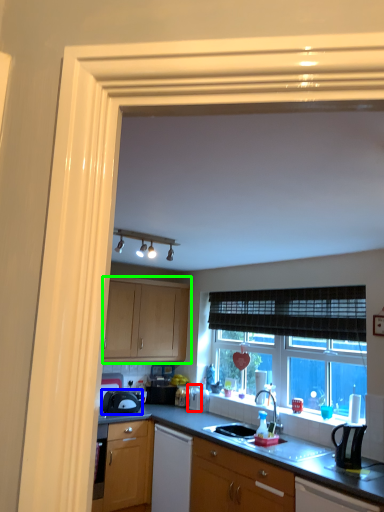
Question: Which is farther away from appliance (highlighted by a red box)? kitchen appliance (highlighted by a blue box) or cabinetry (highlighted by a green box)?

Choices:
 (A) kitchen appliance
 (B) cabinetry

Answer: (B)